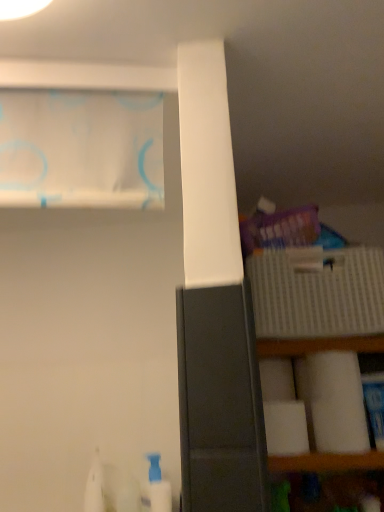
Question: Is the position of white matte toilet paper at right, which is counted as the 2th toilet paper, starting from the back, more distant than that of white sheer curtain at upper left?

Choices:
 (A) yes
 (B) no

Answer: (A)

Question: Is white matte toilet paper at right, which is the 1th toilet paper in front-to-back order, thinner than white sheer curtain at upper left?

Choices:
 (A) yes
 (B) no

Answer: (B)

Question: Could you tell me if white matte toilet paper at right, which is the 1th toilet paper in front-to-back order, is turned towards white sheer curtain at upper left?

Choices:
 (A) no
 (B) yes

Answer: (A)

Question: From a real-world perspective, is white matte toilet paper at right, which is the 1th toilet paper in front-to-back order, on white sheer curtain at upper left?

Choices:
 (A) no
 (B) yes

Answer: (A)

Question: Considering the relative sizes of white matte toilet paper at right, which is the 1th toilet paper in front-to-back order, and white sheer curtain at upper left in the image provided, is white matte toilet paper at right, which is the 1th toilet paper in front-to-back order, smaller than white sheer curtain at upper left?

Choices:
 (A) yes
 (B) no

Answer: (A)

Question: From a real-world perspective, is white sheer curtain at upper left physically located above or below white plastic bottle at lower left?

Choices:
 (A) below
 (B) above

Answer: (B)

Question: Looking at the image, does white sheer curtain at upper left seem bigger or smaller compared to white plastic bottle at lower left?

Choices:
 (A) big
 (B) small

Answer: (A)

Question: Is point (18, 143) closer or farther from the camera than point (160, 493)?

Choices:
 (A) farther
 (B) closer

Answer: (B)

Question: In the image, is white sheer curtain at upper left positioned in front of or behind white plastic bottle at lower left?

Choices:
 (A) behind
 (B) front

Answer: (B)

Question: From the image's perspective, relative to white matte toilet paper at right, which is counted as the 2th toilet paper, starting from the back, is white sheer curtain at upper left above or below?

Choices:
 (A) below
 (B) above

Answer: (B)

Question: Is point (119, 144) positioned closer to the camera than point (296, 431)?

Choices:
 (A) closer
 (B) farther

Answer: (A)

Question: From their relative heights in the image, would you say white sheer curtain at upper left is taller or shorter than white matte toilet paper at right, which is the 1th toilet paper in front-to-back order?

Choices:
 (A) short
 (B) tall

Answer: (B)

Question: Is white sheer curtain at upper left inside or outside of white matte toilet paper at right, which is counted as the 2th toilet paper, starting from the back?

Choices:
 (A) inside
 (B) outside

Answer: (B)

Question: Is white plastic bottle at lower left situated inside white sheer curtain at upper left or outside?

Choices:
 (A) outside
 (B) inside

Answer: (A)

Question: From the image's perspective, is white plastic bottle at lower left positioned above or below white sheer curtain at upper left?

Choices:
 (A) above
 (B) below

Answer: (B)